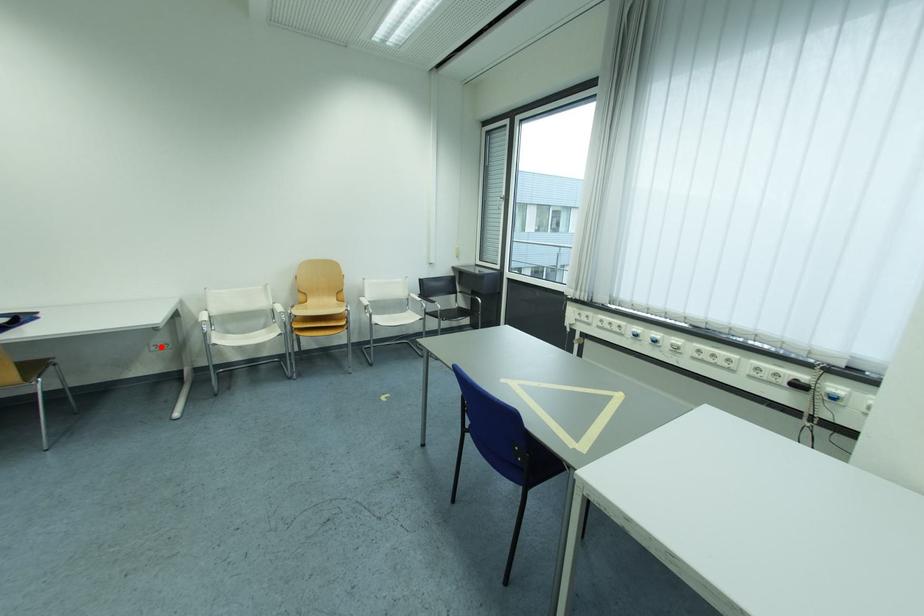
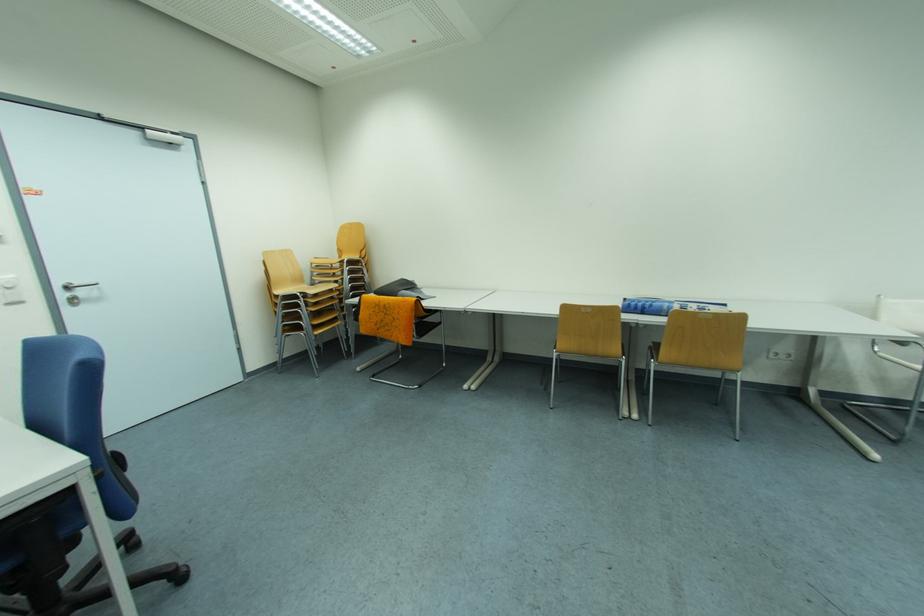
Find the pixel in the second image that matches the highlighted location in the first image.

(783, 354)